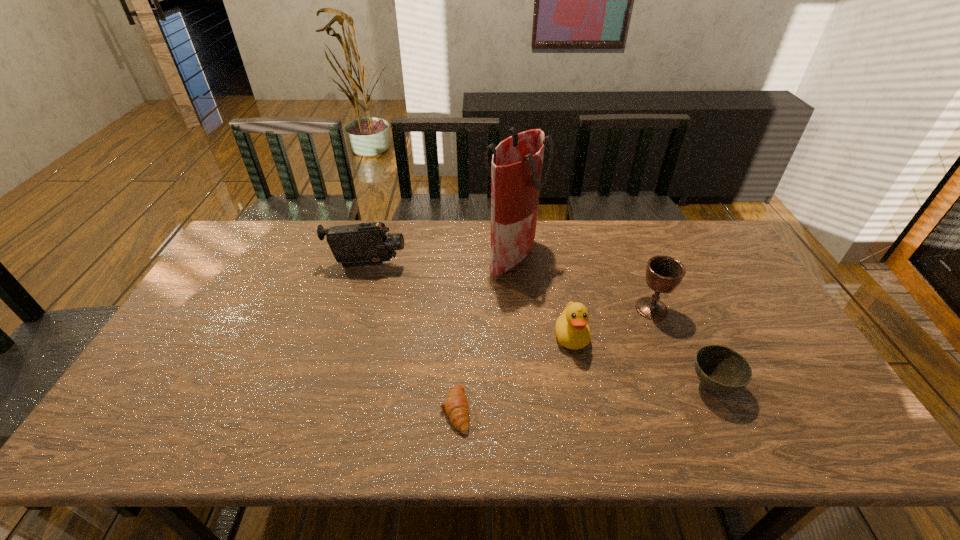
The height and width of the screenshot is (540, 960). In order to click on empty space that is in between the camcorder and the tallest object in this screenshot , I will do `click(440, 261)`.

Find the location of a particular element. The image size is (960, 540). object that ranks as the second closest to the chalice is located at coordinates (572, 331).

Identify the location of object that is the fifth closest to the crescent roll. The width and height of the screenshot is (960, 540). (721, 370).

The width and height of the screenshot is (960, 540). Identify the location of vacant region that satisfies the following two spatial constraints: 1. on the front-facing side of the camcorder; 2. on the back side of the crescent roll. (325, 409).

Identify the location of vacant space that satisfies the following two spatial constraints: 1. on the back side of the chalice; 2. on the front-facing side of the camcorder. The image size is (960, 540). (635, 265).

Image resolution: width=960 pixels, height=540 pixels. Find the location of `free region that satisfies the following two spatial constraints: 1. on the front-facing side of the camcorder; 2. on the left side of the second object from left to right`. free region that satisfies the following two spatial constraints: 1. on the front-facing side of the camcorder; 2. on the left side of the second object from left to right is located at coordinates (325, 409).

The image size is (960, 540). Identify the location of free spot that satisfies the following two spatial constraints: 1. on the front-facing side of the leftmost object; 2. on the right side of the chalice. (354, 309).